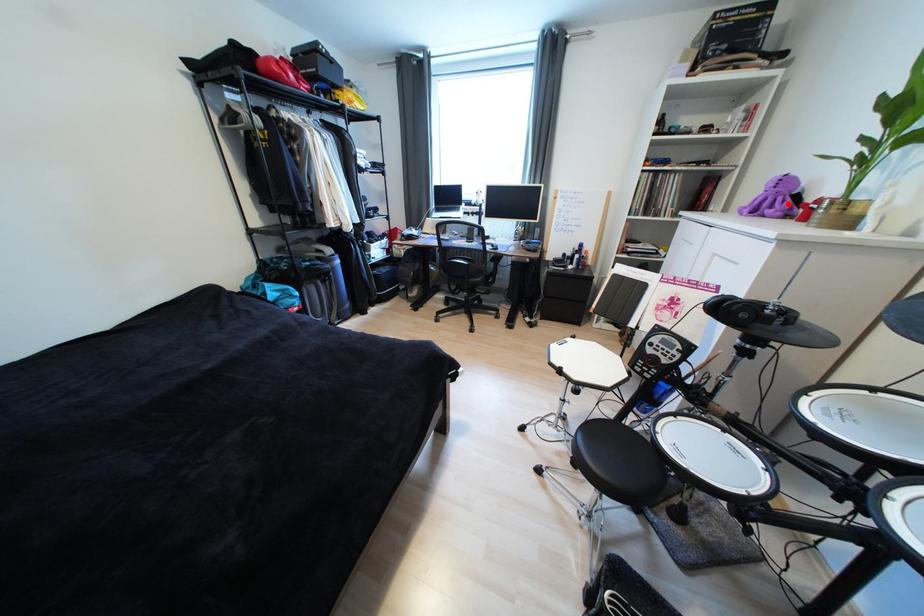
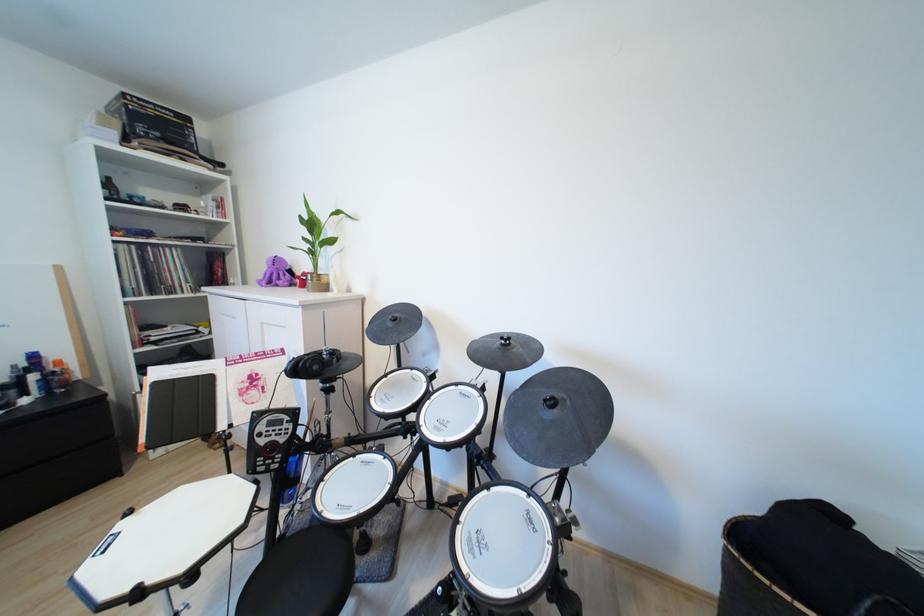
Where in the second image is the point corresponding to the highlighted location from the first image?

(289, 277)